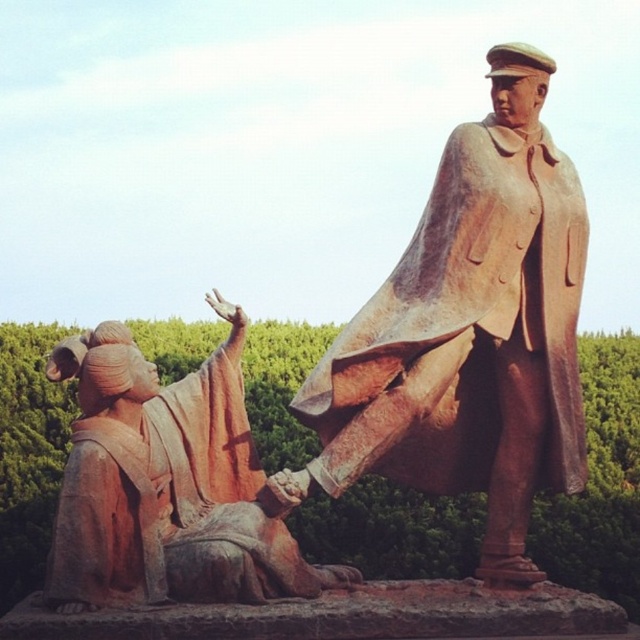
You are an art conservator assessing the space between two statues in the garden. The statues are the rustic bronze statue at upper right and the rustic stone statue at lower left. Given that the bronze statue is narrower than the stone one, can you determine which statue requires more space for maintenance access around it?

The rustic stone statue at lower left requires more space for maintenance access because its width is greater than the rustic bronze statue at upper right.

You are an art conservator analyzing the placement of the rustic bronze statue at upper right in the image. Based on its coordinates, which corner of the image does it belong to?

The rustic bronze statue at upper right is located at coordinates point (x=470, y=332). Since the x and y values are both above 0.5, it is positioned in the upper right corner of the image.

You are an art student analyzing the spatial arrangement of the two statues in the image. Which statue is closer to your viewpoint, the rustic bronze statue at upper right or the rustic stone statue at lower left?

The rustic bronze statue at upper right is closer to the viewer than the rustic stone statue at lower left.